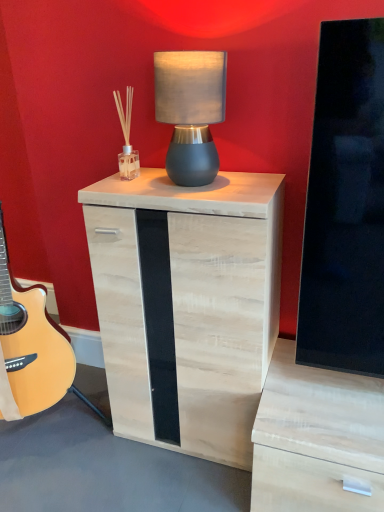
Where is `free spot to the left of matte gray lampshade at center`? This screenshot has width=384, height=512. free spot to the left of matte gray lampshade at center is located at coordinates (132, 183).